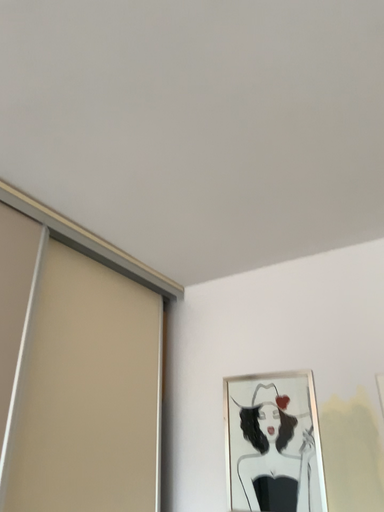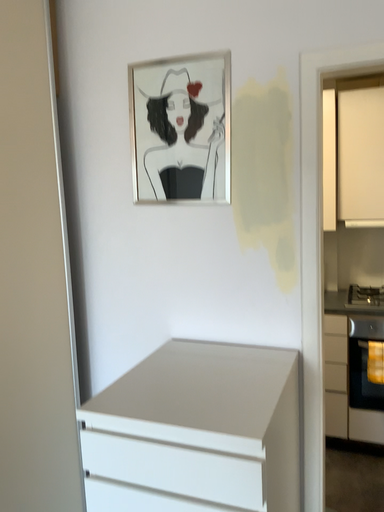
Question: Which way did the camera rotate in the video?

Choices:
 (A) rotated left
 (B) rotated right

Answer: (B)